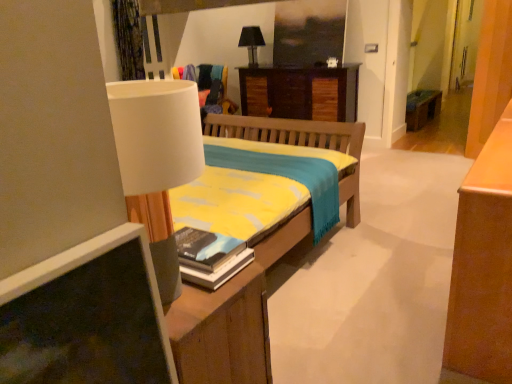
Question: From the image's perspective, is wooden bench at right located above or below black fabric lampshade at upper center?

Choices:
 (A) above
 (B) below

Answer: (B)

Question: Is wooden bench at right situated inside black fabric lampshade at upper center or outside?

Choices:
 (A) inside
 (B) outside

Answer: (B)

Question: Estimate the real-world distances between objects in this image. Which object is closer to the hardcover book at center?

Choices:
 (A) wooden bench at right
 (B) wooden desk at center
 (C) black fabric lampshade at upper center

Answer: (B)

Question: Which object is positioned closest to the wooden bench at right?

Choices:
 (A) hardcover book at center
 (B) wooden desk at center
 (C) black fabric lampshade at upper center

Answer: (B)